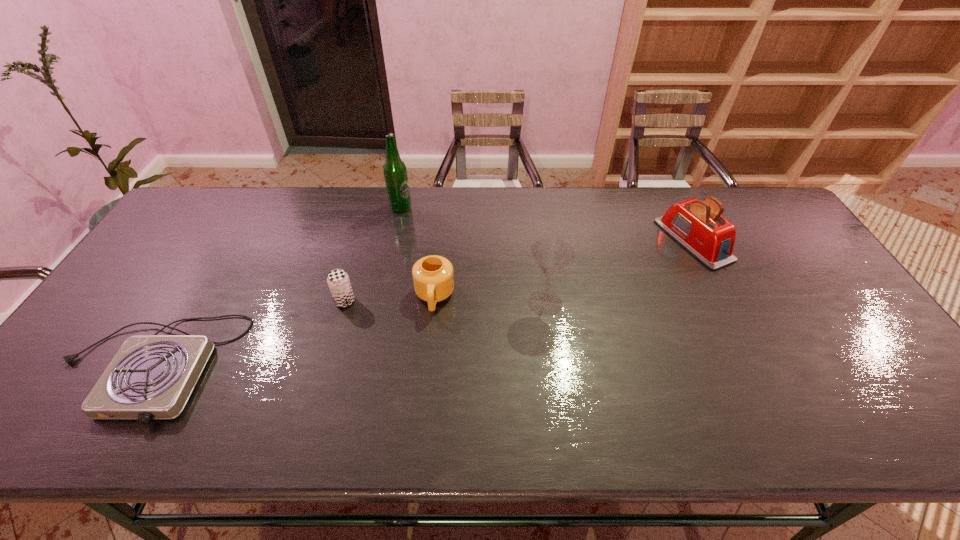
You are a GUI agent. You are given a task and a screenshot of the screen. Output one action in this format:
    pyautogui.click(x=<x>, y=<y>)
    Task: Click on the free location located 0.060m on the label of the third object from left to right
    
    Given the screenshot: What is the action you would take?
    pyautogui.click(x=429, y=207)

At what (x,y) coordinates should I click in order to perform the action: click on vacant area located on the front of the flute glass. Please return your answer as a coordinate pair (x, y). Image resolution: width=960 pixels, height=540 pixels. Looking at the image, I should click on (557, 394).

Where is `blank space located on the front of the toaster`? The image size is (960, 540). blank space located on the front of the toaster is located at coordinates pos(746,345).

I want to click on vacant space situated on the handle side of the mug, so click(x=429, y=349).

Identify the location of vacant region located 0.100m on the right of the beer can. (392, 301).

This screenshot has width=960, height=540. Identify the location of beer bottle that is at the far edge. (395, 172).

Identify the location of toaster located in the far edge section of the desktop. Image resolution: width=960 pixels, height=540 pixels. (697, 225).

Locate an element on the screen. Image resolution: width=960 pixels, height=540 pixels. object located in the near edge section of the desktop is located at coordinates (151, 377).

At what (x,y) coordinates should I click in order to perform the action: click on object that is at the left edge. Please return your answer as a coordinate pair (x, y). Image resolution: width=960 pixels, height=540 pixels. Looking at the image, I should click on (151, 377).

Find the location of a particular element. object that is at the near left corner is located at coordinates (151, 377).